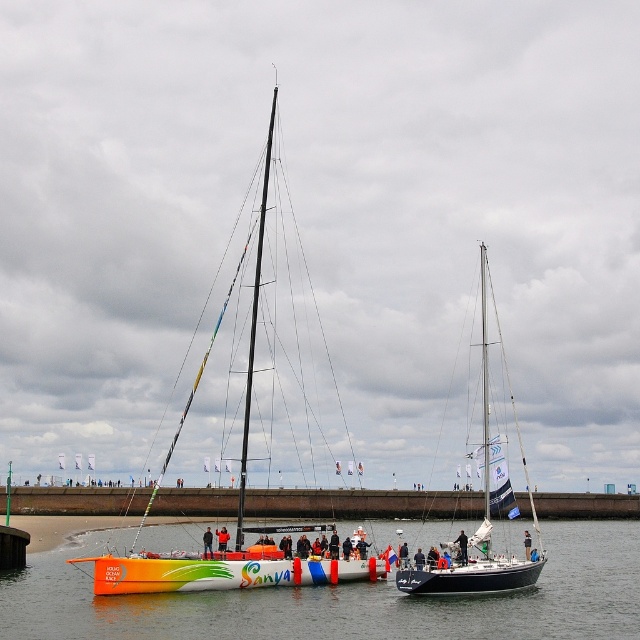
Between smooth water at center and brown concrete dock at center, which one appears on the right side from the viewer's perspective?

smooth water at center is more to the right.

Is point (205, 612) more distant than point (378, 490)?

No, (205, 612) is in front of (378, 490).

Which is behind, point (506, 628) or point (376, 496)?

The point (376, 496) is more distant.

This screenshot has height=640, width=640. In order to click on smooth water at center in this screenshot , I will do `click(340, 600)`.

Which of these two, black matte sailboat at center or black leather jacket at center, stands taller?

Standing taller between the two is black matte sailboat at center.

Is black matte sailboat at center to the right of black leather jacket at center from the viewer's perspective?

Correct, you'll find black matte sailboat at center to the right of black leather jacket at center.

Who is more forward, (x=452, y=588) or (x=227, y=536)?

Positioned in front is point (x=452, y=588).

This screenshot has width=640, height=640. I want to click on black matte sailboat at center, so click(x=484, y=508).

Can you confirm if black matte sailboat at center is taller than dark blue fabric jacket at center?

Yes.

Between point (406, 579) and point (205, 538), which one is positioned behind?

The point (205, 538) is more distant.

Which is in front, point (444, 589) or point (204, 544)?

Point (444, 589) is in front.

Where is `black matte sailboat at center`? The width and height of the screenshot is (640, 640). black matte sailboat at center is located at coordinates (484, 508).